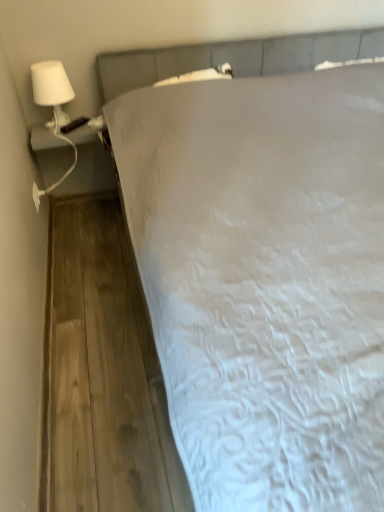
Question: Considering their positions, is white matte lamp at upper left located in front of or behind white textured bed at center?

Choices:
 (A) behind
 (B) front

Answer: (A)

Question: Is white matte lamp at upper left inside or outside of white textured bed at center?

Choices:
 (A) outside
 (B) inside

Answer: (A)

Question: From the image's perspective, is white matte lamp at upper left located above or below white textured bed at center?

Choices:
 (A) below
 (B) above

Answer: (B)

Question: Which is correct: white textured bed at center is inside white matte lamp at upper left, or outside of it?

Choices:
 (A) outside
 (B) inside

Answer: (A)

Question: Looking at the image, does white textured bed at center seem bigger or smaller compared to white matte lamp at upper left?

Choices:
 (A) big
 (B) small

Answer: (A)

Question: Is point (362, 274) positioned closer to the camera than point (57, 69)?

Choices:
 (A) closer
 (B) farther

Answer: (A)

Question: Based on their positions, is white textured bed at center located to the left or right of white matte lamp at upper left?

Choices:
 (A) left
 (B) right

Answer: (B)